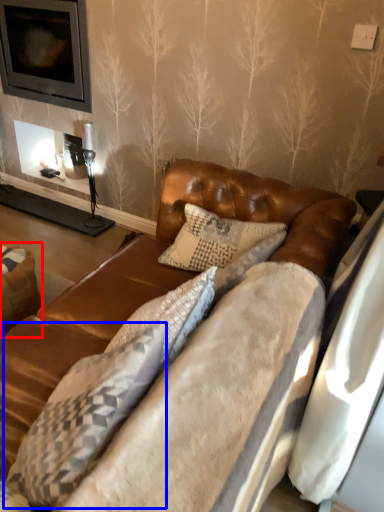
Question: Which of the following is the farthest to the observer, swivel chair (highlighted by a red box) or pillow (highlighted by a blue box)?

Choices:
 (A) swivel chair
 (B) pillow

Answer: (A)